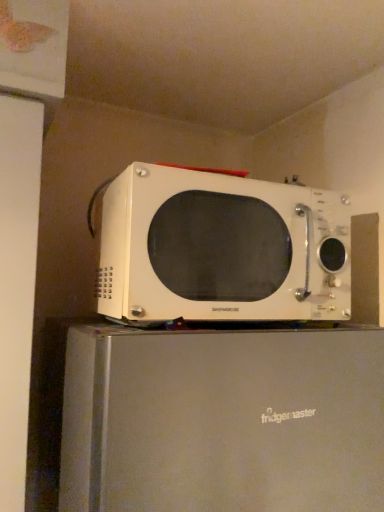
What do you see at coordinates (221, 249) in the screenshot? The image size is (384, 512). I see `white matte microwave at center` at bounding box center [221, 249].

At what (x,y) coordinates should I click in order to perform the action: click on white matte microwave at center. Please return your answer as a coordinate pair (x, y). Looking at the image, I should click on (221, 249).

What is the approximate height of white matte microwave at center?

10.80 inches.

The width and height of the screenshot is (384, 512). What do you see at coordinates (222, 421) in the screenshot?
I see `white matte microwave at upper center` at bounding box center [222, 421].

Identify the location of white matte microwave at upper center. The image size is (384, 512). (222, 421).

You are a GUI agent. You are given a task and a screenshot of the screen. Output one action in this format:
    pyautogui.click(x=<x>, y=<y>)
    Task: Click on the white matte microwave at center
    Image resolution: width=384 pixels, height=512 pixels.
    Given the screenshot: What is the action you would take?
    pyautogui.click(x=221, y=249)

Visually, is white matte microwave at upper center positioned to the left or to the right of white matte microwave at center?

white matte microwave at upper center is positioned on white matte microwave at center's left side.

From the picture: Is white matte microwave at upper center in front of or behind white matte microwave at center in the image?

In the image, white matte microwave at upper center appears in front of white matte microwave at center.

Which is less distant, [324,400] or [226,217]?

Point [324,400] is positioned closer to the camera compared to point [226,217].

From the image's perspective, which one is positioned higher, white matte microwave at upper center or white matte microwave at center?

From the image's view, white matte microwave at center is above.

From a real-world perspective, is white matte microwave at upper center above or below white matte microwave at center?

white matte microwave at upper center is below white matte microwave at center.

Considering the relative sizes of white matte microwave at upper center and white matte microwave at center in the image provided, is white matte microwave at upper center thinner than white matte microwave at center?

No.

Is white matte microwave at upper center taller or shorter than white matte microwave at center?

white matte microwave at upper center is taller than white matte microwave at center.

Can you confirm if white matte microwave at upper center is smaller than white matte microwave at center?

No.

Would you say white matte microwave at center is part of white matte microwave at upper center's contents?

No.

Is white matte microwave at upper center next to white matte microwave at center?

No, white matte microwave at upper center is not next to white matte microwave at center.

Does white matte microwave at upper center turn towards white matte microwave at center?

No, white matte microwave at upper center is not facing towards white matte microwave at center.

Where is `appliance lying in front of the white matte microwave at center`? appliance lying in front of the white matte microwave at center is located at coordinates (222, 421).

Between white matte microwave at center and white matte microwave at upper center, which one appears on the left side from the viewer's perspective?

Positioned to the left is white matte microwave at upper center.

From the picture: Between white matte microwave at center and white matte microwave at upper center, which one is positioned in front?

Positioned in front is white matte microwave at upper center.

Which point is more forward, [329,320] or [228,373]?

The point [228,373] is closer.

From the picture: From the image's perspective, between white matte microwave at center and white matte microwave at upper center, which one is located above?

From the image's view, white matte microwave at center is above.

From a real-world perspective, is white matte microwave at center above or below white matte microwave at upper center?

Clearly, from a real-world perspective, white matte microwave at center is above white matte microwave at upper center.

Considering the sizes of objects white matte microwave at center and white matte microwave at upper center in the image provided, who is wider, white matte microwave at center or white matte microwave at upper center?

Wider between the two is white matte microwave at upper center.

Considering the sizes of objects white matte microwave at center and white matte microwave at upper center in the image provided, who is shorter, white matte microwave at center or white matte microwave at upper center?

white matte microwave at center is shorter.

Is white matte microwave at center bigger than white matte microwave at upper center?

Incorrect, white matte microwave at center is not larger than white matte microwave at upper center.

From the picture: Is white matte microwave at center surrounding white matte microwave at upper center?

No, white matte microwave at upper center is not surrounded by white matte microwave at center.

Is there a large distance between white matte microwave at center and white matte microwave at upper center?

No, white matte microwave at center is not far from white matte microwave at upper center.

Is white matte microwave at center looking in the opposite direction of white matte microwave at upper center?

That's not correct — white matte microwave at center is not looking away from white matte microwave at upper center.

How different are the orientations of white matte microwave at center and white matte microwave at upper center in degrees?

The angle between the facing direction of white matte microwave at center and the facing direction of white matte microwave at upper center is 2.64 degrees.

The height and width of the screenshot is (512, 384). In order to click on microwave oven behind the white matte microwave at upper center in this screenshot , I will do `click(221, 249)`.

Locate an element on the screen. This screenshot has width=384, height=512. microwave oven to the right of white matte microwave at upper center is located at coordinates (221, 249).

The height and width of the screenshot is (512, 384). Find the location of `appliance located on the left of white matte microwave at center`. appliance located on the left of white matte microwave at center is located at coordinates (222, 421).